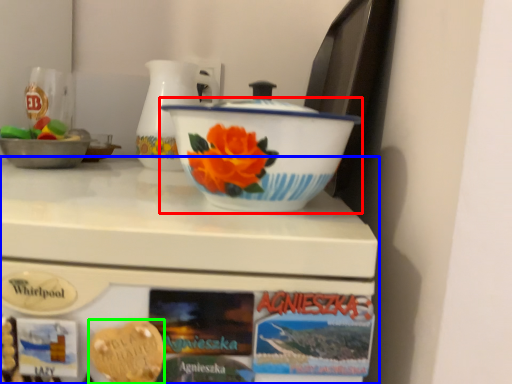
Question: Which object is positioned closest to basin (highlighted by a red box)? Select from table (highlighted by a blue box) and food (highlighted by a green box).

Choices:
 (A) table
 (B) food

Answer: (A)